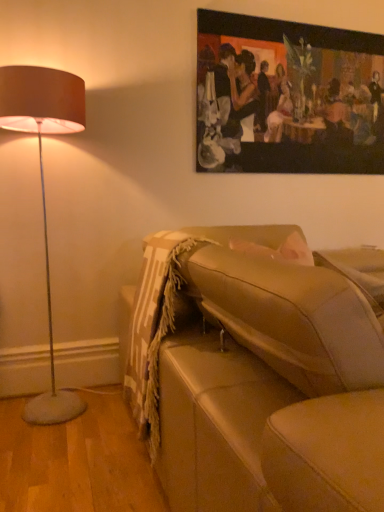
Question: Do you think oil painting at upper center is within beige leather couch at lower right, or outside of it?

Choices:
 (A) inside
 (B) outside

Answer: (B)

Question: Looking at their shapes, would you say oil painting at upper center is wider or thinner than beige leather couch at lower right?

Choices:
 (A) thin
 (B) wide

Answer: (A)

Question: Would you say oil painting at upper center is to the left or to the right of beige leather couch at lower right in the picture?

Choices:
 (A) right
 (B) left

Answer: (A)

Question: Looking at their shapes, would you say beige leather couch at lower right is wider or thinner than oil painting at upper center?

Choices:
 (A) thin
 (B) wide

Answer: (B)

Question: Considering the positions of beige leather couch at lower right and oil painting at upper center in the image, is beige leather couch at lower right taller or shorter than oil painting at upper center?

Choices:
 (A) short
 (B) tall

Answer: (A)

Question: In the image, is beige leather couch at lower right positioned in front of or behind oil painting at upper center?

Choices:
 (A) behind
 (B) front

Answer: (B)

Question: From the image's perspective, is beige leather couch at lower right positioned above or below oil painting at upper center?

Choices:
 (A) above
 (B) below

Answer: (B)